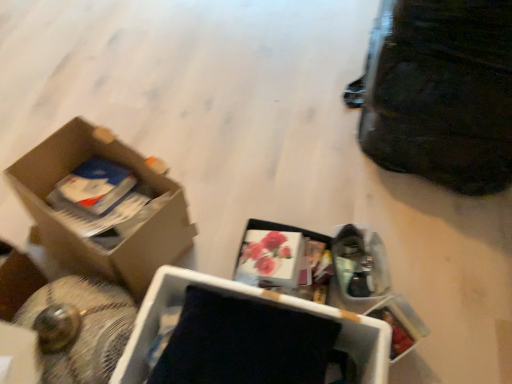
Where is `free spot in front of black leather bag at upper right`? The height and width of the screenshot is (384, 512). free spot in front of black leather bag at upper right is located at coordinates (428, 239).